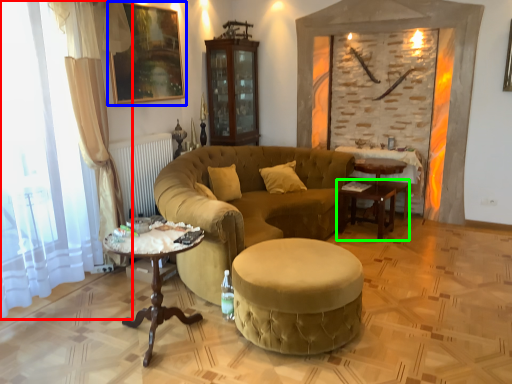
Question: Which object is the farthest from curtain (highlighted by a red box)? Choose among these: picture frame (highlighted by a blue box) or table (highlighted by a green box).

Choices:
 (A) picture frame
 (B) table

Answer: (B)